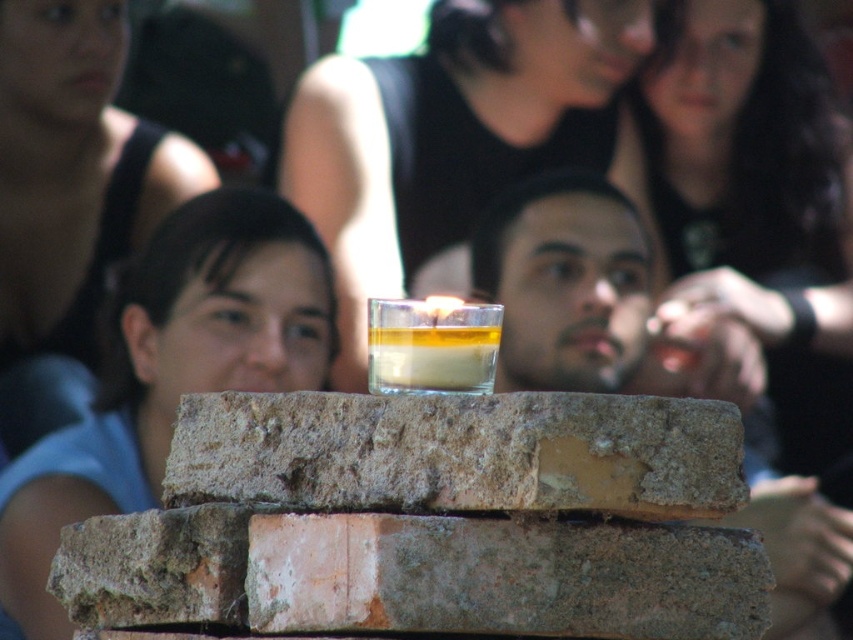
Question: From the image, what is the correct spatial relationship of translucent glass cup at center in relation to translucent glass candle at center?

Choices:
 (A) right
 (B) left

Answer: (B)

Question: Among these objects, which one is farthest from the camera?

Choices:
 (A) smooth skin face at center
 (B) matte concrete bricks at center
 (C) rusty concrete block at center

Answer: (B)

Question: Can you confirm if matte black hair at center is smaller than translucent glass candle at center?

Choices:
 (A) no
 (B) yes

Answer: (A)

Question: Which point is farther from the camera taking this photo?

Choices:
 (A) (474, 429)
 (B) (393, 208)
 (C) (486, 305)

Answer: (B)

Question: Which of these objects is positioned closest to the smooth skin face at center?

Choices:
 (A) translucent glass candle at center
 (B) translucent glass cup at center
 (C) rusty concrete block at center
 (D) matte concrete bricks at center

Answer: (D)

Question: Is matte black hair at center in front of smooth skin face at center?

Choices:
 (A) yes
 (B) no

Answer: (B)